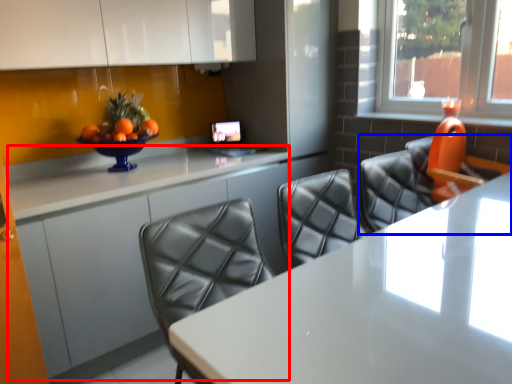
Question: Among these objects, which one is farthest to the camera, counter (highlighted by a red box) or chair (highlighted by a blue box)?

Choices:
 (A) counter
 (B) chair

Answer: (A)